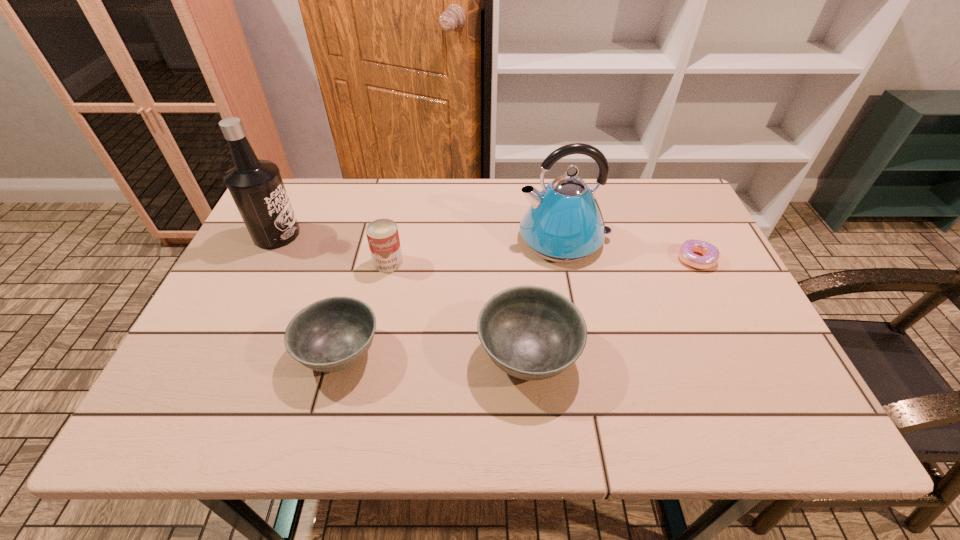
Locate an element on the screen. The height and width of the screenshot is (540, 960). free space for a new bowl on the right is located at coordinates (718, 358).